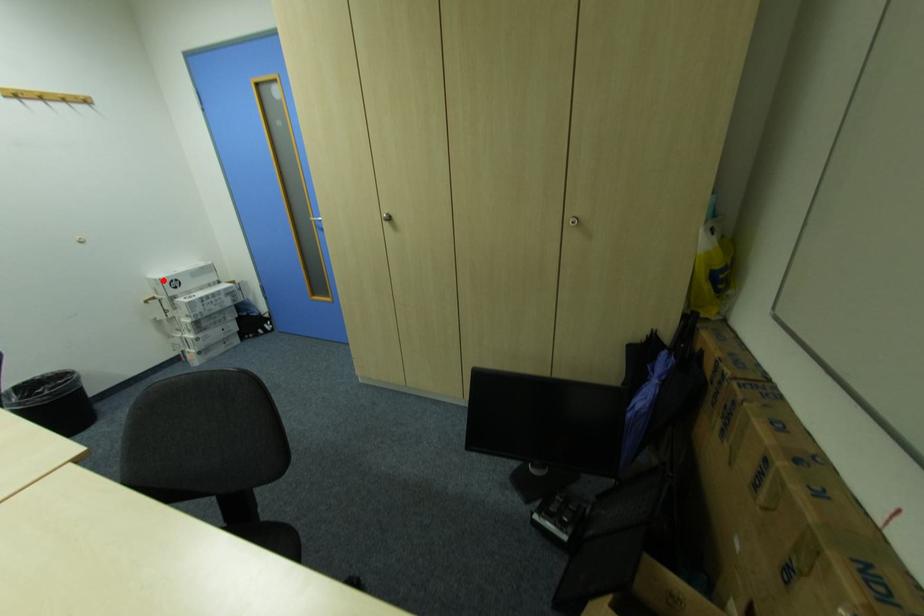
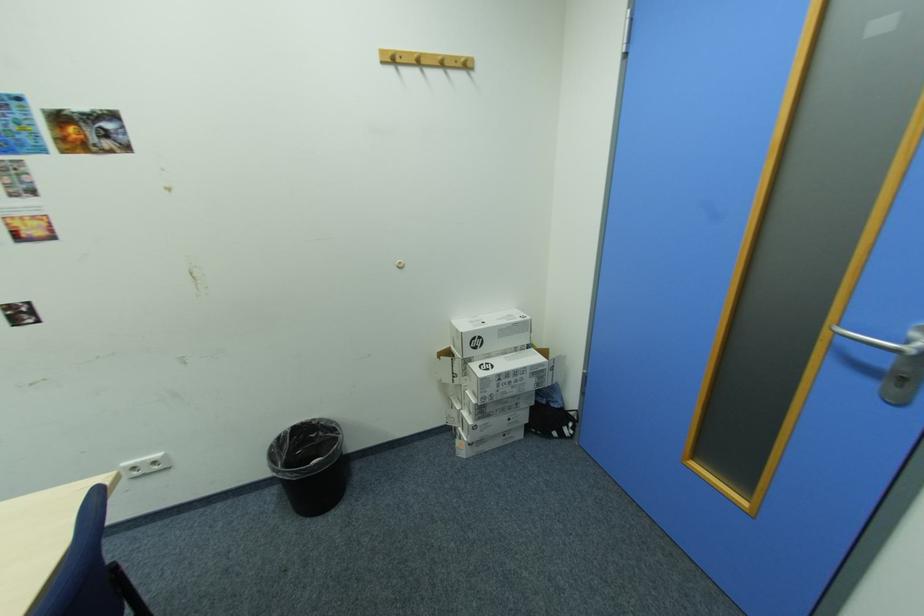
Where in the second image is the point corresponding to the highlighted location from the first image?

(465, 331)